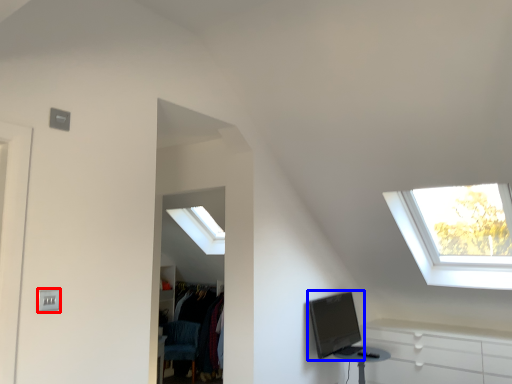
Question: Among these objects, which one is nearest to the camera, electric outlet (highlighted by a red box) or computer monitor (highlighted by a blue box)?

Choices:
 (A) electric outlet
 (B) computer monitor

Answer: (A)